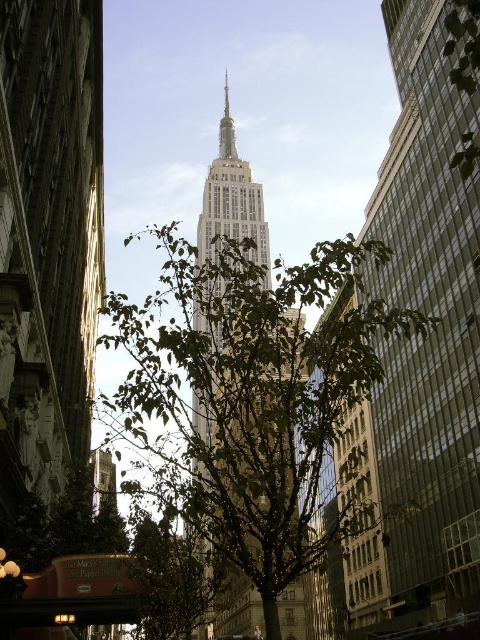
Which is behind, point (134, 404) or point (225, 100)?

The point (225, 100) is behind.

Can you confirm if green leafy tree at center is positioned to the left of gold metallic spire at center?

No, green leafy tree at center is not to the left of gold metallic spire at center.

The height and width of the screenshot is (640, 480). What do you see at coordinates (250, 396) in the screenshot?
I see `green leafy tree at center` at bounding box center [250, 396].

Locate an element on the screen. This screenshot has width=480, height=640. green leafy tree at center is located at coordinates (250, 396).

Does glassy reflective skyscraper at center appear over gold metallic spire at center?

Actually, glassy reflective skyscraper at center is below gold metallic spire at center.

Is point (393, 145) positioned before point (228, 148)?

That is True.

Find the location of `glassy reflective skyscraper at center`. glassy reflective skyscraper at center is located at coordinates (423, 337).

Looking at this image, does gold stone tower at center have a greater height compared to gold metallic spire at center?

Indeed, gold stone tower at center has a greater height compared to gold metallic spire at center.

Which is behind, point (195, 419) or point (228, 147)?

The point (228, 147) is more distant.

You are a GUI agent. You are given a task and a screenshot of the screen. Output one action in this format:
    pyautogui.click(x=<x>, y=<y>)
    Task: Click on the gold stone tower at center
    The width and height of the screenshot is (480, 640).
    Given the screenshot: What is the action you would take?
    pyautogui.click(x=232, y=211)